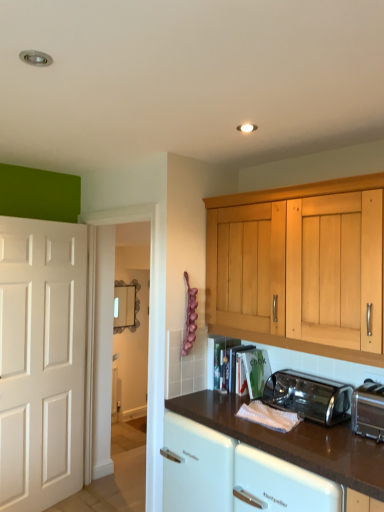
What is the approximate height of brown glossy countertop at lower center?

It is 34.30 inches.

The image size is (384, 512). I want to click on silver metallic toaster at lower right, marked as the first toaster in a front-to-back arrangement, so click(368, 410).

The image size is (384, 512). What do you see at coordinates (309, 396) in the screenshot?
I see `polished stainless steel toaster at lower center, the 1th toaster when ordered from back to front` at bounding box center [309, 396].

Find the location of a particular element. This screenshot has width=384, height=512. brown glossy countertop at lower center is located at coordinates (294, 441).

In terms of width, does silver metallic toaster at lower right, marked as the first toaster in a front-to-back arrangement, look wider or thinner when compared to brown glossy countertop at lower center?

Clearly, silver metallic toaster at lower right, marked as the first toaster in a front-to-back arrangement, has less width compared to brown glossy countertop at lower center.

Looking at the image, does silver metallic toaster at lower right, arranged as the 2th toaster when viewed from the back, seem bigger or smaller compared to brown glossy countertop at lower center?

Clearly, silver metallic toaster at lower right, arranged as the 2th toaster when viewed from the back, is smaller in size than brown glossy countertop at lower center.

Is point (375, 414) in front of point (321, 457)?

No, it is not.

Identify the location of toaster located in front of the polished stainless steel toaster at lower center, the 1th toaster when ordered from back to front. Image resolution: width=384 pixels, height=512 pixels. (368, 410).

Is silver metallic toaster at lower right, arranged as the 2th toaster when viewed from the back, directly adjacent to polished stainless steel toaster at lower center, the 1th toaster when ordered from back to front?

No, silver metallic toaster at lower right, arranged as the 2th toaster when viewed from the back, is not next to polished stainless steel toaster at lower center, the 1th toaster when ordered from back to front.

How far apart are silver metallic toaster at lower right, marked as the first toaster in a front-to-back arrangement, and polished stainless steel toaster at lower center, the 1th toaster when ordered from back to front?

silver metallic toaster at lower right, marked as the first toaster in a front-to-back arrangement, is 7.89 inches from polished stainless steel toaster at lower center, the 1th toaster when ordered from back to front.

From a real-world perspective, which object rests below the other?

polished stainless steel toaster at lower center, the 1th toaster when ordered from back to front, is physically lower.

From the image's perspective, would you say brown glossy countertop at lower center is positioned over silver metallic toaster at lower right, marked as the first toaster in a front-to-back arrangement?

No, from the image's perspective, brown glossy countertop at lower center is not over silver metallic toaster at lower right, marked as the first toaster in a front-to-back arrangement.

Would you say brown glossy countertop at lower center is outside silver metallic toaster at lower right, arranged as the 2th toaster when viewed from the back?

Yes.

Measure the distance from brown glossy countertop at lower center to silver metallic toaster at lower right, marked as the first toaster in a front-to-back arrangement.

A distance of 11.35 inches exists between brown glossy countertop at lower center and silver metallic toaster at lower right, marked as the first toaster in a front-to-back arrangement.

Is brown glossy countertop at lower center taller or shorter than silver metallic toaster at lower right, arranged as the 2th toaster when viewed from the back?

brown glossy countertop at lower center is taller than silver metallic toaster at lower right, arranged as the 2th toaster when viewed from the back.

In terms of width, does polished stainless steel toaster at lower center, which is the second toaster from front to back, look wider or thinner when compared to brown glossy countertop at lower center?

Considering their sizes, polished stainless steel toaster at lower center, which is the second toaster from front to back, looks slimmer than brown glossy countertop at lower center.

Who is smaller, polished stainless steel toaster at lower center, the 1th toaster when ordered from back to front, or brown glossy countertop at lower center?

Smaller between the two is polished stainless steel toaster at lower center, the 1th toaster when ordered from back to front.

Starting from the brown glossy countertop at lower center, which toaster is the 1st one to the right? Please provide its 2D coordinates.

[(309, 396)]

From the picture: Who is shorter, brown glossy countertop at lower center or polished stainless steel toaster at lower center, which is the second toaster from front to back?

With less height is polished stainless steel toaster at lower center, which is the second toaster from front to back.

Is brown glossy countertop at lower center bigger than polished stainless steel toaster at lower center, which is the second toaster from front to back?

Yes, brown glossy countertop at lower center is bigger than polished stainless steel toaster at lower center, which is the second toaster from front to back.

Do you think brown glossy countertop at lower center is within polished stainless steel toaster at lower center, which is the second toaster from front to back, or outside of it?

brown glossy countertop at lower center lies outside polished stainless steel toaster at lower center, which is the second toaster from front to back.

Considering the points (317, 471) and (286, 397), which point is in front, point (317, 471) or point (286, 397)?

Positioned in front is point (317, 471).

How different are the orientations of polished stainless steel toaster at lower center, which is the second toaster from front to back, and silver metallic toaster at lower right, marked as the first toaster in a front-to-back arrangement, in degrees?

0.00467 degrees.

Considering the sizes of objects polished stainless steel toaster at lower center, which is the second toaster from front to back, and silver metallic toaster at lower right, marked as the first toaster in a front-to-back arrangement, in the image provided, who is bigger, polished stainless steel toaster at lower center, which is the second toaster from front to back, or silver metallic toaster at lower right, marked as the first toaster in a front-to-back arrangement,?

Bigger between the two is polished stainless steel toaster at lower center, which is the second toaster from front to back.

Is polished stainless steel toaster at lower center, which is the second toaster from front to back, outside of silver metallic toaster at lower right, arranged as the 2th toaster when viewed from the back?

Indeed, polished stainless steel toaster at lower center, which is the second toaster from front to back, is completely outside silver metallic toaster at lower right, arranged as the 2th toaster when viewed from the back.

Is polished stainless steel toaster at lower center, which is the second toaster from front to back, closer to the viewer compared to silver metallic toaster at lower right, marked as the first toaster in a front-to-back arrangement?

No, it is behind silver metallic toaster at lower right, marked as the first toaster in a front-to-back arrangement.

You are a GUI agent. You are given a task and a screenshot of the screen. Output one action in this format:
    pyautogui.click(x=<x>, y=<y>)
    Task: Click on the countertop that is in front of the silver metallic toaster at lower right, arranged as the 2th toaster when viewed from the back
    The height and width of the screenshot is (512, 384).
    Given the screenshot: What is the action you would take?
    pyautogui.click(x=294, y=441)

Identify the location of toaster above the polished stainless steel toaster at lower center, which is the second toaster from front to back (from a real-world perspective). This screenshot has width=384, height=512. (368, 410).

Looking at this image, when comparing their distances from polished stainless steel toaster at lower center, the 1th toaster when ordered from back to front, does brown glossy countertop at lower center or silver metallic toaster at lower right, arranged as the 2th toaster when viewed from the back, seem closer?

The object closer to polished stainless steel toaster at lower center, the 1th toaster when ordered from back to front, is silver metallic toaster at lower right, arranged as the 2th toaster when viewed from the back.

Estimate the real-world distances between objects in this image. Which object is further from polished stainless steel toaster at lower center, which is the second toaster from front to back, silver metallic toaster at lower right, arranged as the 2th toaster when viewed from the back, or brown glossy countertop at lower center?

brown glossy countertop at lower center is positioned further to the anchor polished stainless steel toaster at lower center, which is the second toaster from front to back.

Based on their spatial positions, is polished stainless steel toaster at lower center, the 1th toaster when ordered from back to front, or silver metallic toaster at lower right, marked as the first toaster in a front-to-back arrangement, further from brown glossy countertop at lower center?

silver metallic toaster at lower right, marked as the first toaster in a front-to-back arrangement.

When comparing their distances from brown glossy countertop at lower center, does silver metallic toaster at lower right, marked as the first toaster in a front-to-back arrangement, or polished stainless steel toaster at lower center, the 1th toaster when ordered from back to front, seem closer?

polished stainless steel toaster at lower center, the 1th toaster when ordered from back to front, is closer to brown glossy countertop at lower center.

In the scene shown: When comparing their distances from silver metallic toaster at lower right, arranged as the 2th toaster when viewed from the back, does brown glossy countertop at lower center or polished stainless steel toaster at lower center, which is the second toaster from front to back, seem closer?

Based on the image, polished stainless steel toaster at lower center, which is the second toaster from front to back, appears to be nearer to silver metallic toaster at lower right, arranged as the 2th toaster when viewed from the back.

From the image, which object appears to be farther from silver metallic toaster at lower right, arranged as the 2th toaster when viewed from the back, polished stainless steel toaster at lower center, the 1th toaster when ordered from back to front, or brown glossy countertop at lower center?

brown glossy countertop at lower center is further to silver metallic toaster at lower right, arranged as the 2th toaster when viewed from the back.

The height and width of the screenshot is (512, 384). What are the coordinates of `toaster between silver metallic toaster at lower right, marked as the first toaster in a front-to-back arrangement, and brown glossy countertop at lower center from top to bottom` in the screenshot? It's located at [x=309, y=396].